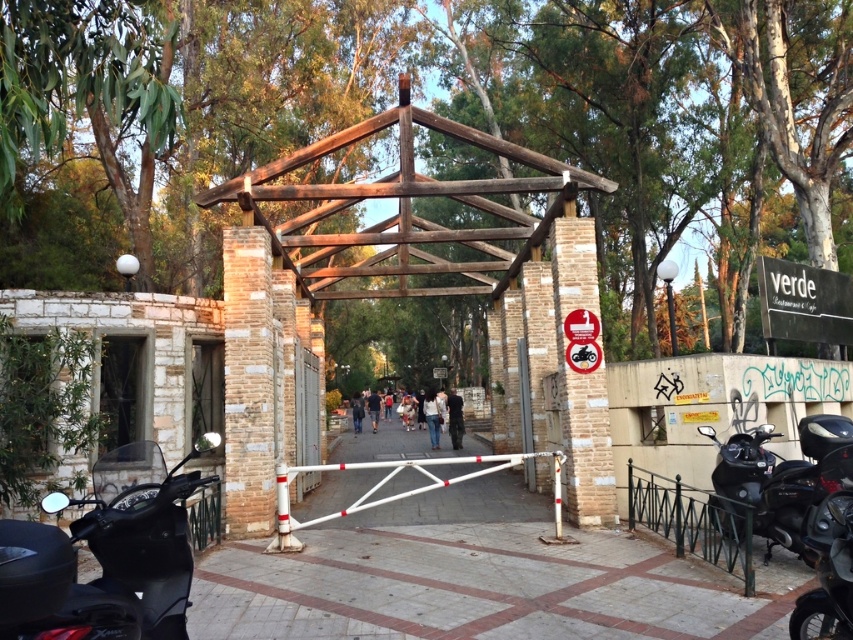
You are standing at the entrance of the park and see the point marked at coordinates (103, 560). Based on the scene description, which object is this point located on?

The point is located on the black matte motorcycle at lower left.

You are a delivery person who needs to park your motorcycle in this area. You have two motorcycles here, a black matte motorcycle at lower left and a shiny black motorcycle at lower right. Which motorcycle should you choose to park closer to the wooden gate to avoid blocking the entrance?

The shiny black motorcycle at lower right is smaller in size compared to the black matte motorcycle at lower left, so parking the shiny black motorcycle at lower right closer to the wooden gate would be better to avoid blocking the entrance.